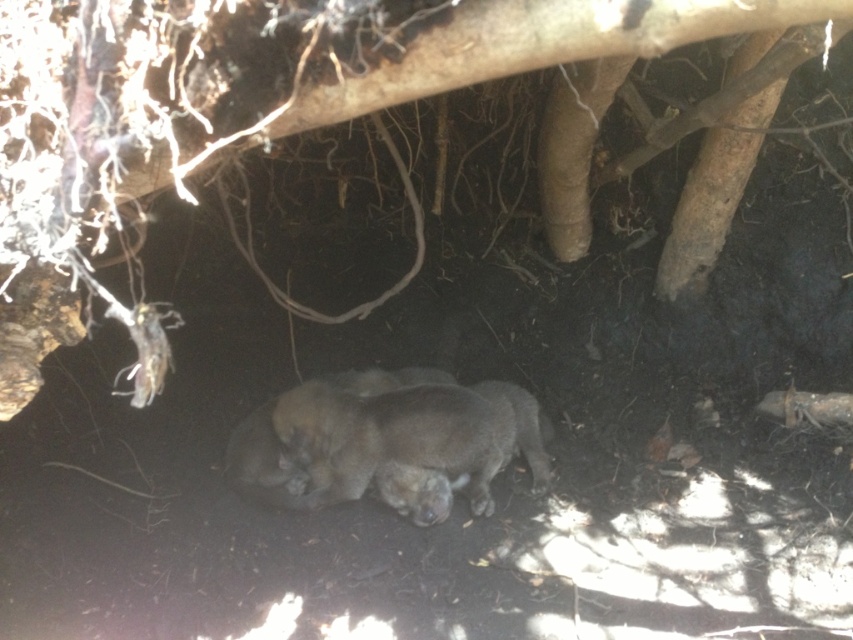
Question: Which object is closer to the camera taking this photo?

Choices:
 (A) fuzzy gray animal at center
 (B) brown rough tree trunk at center

Answer: (B)

Question: Is brown rough tree trunk at center in front of fuzzy gray animal at center?

Choices:
 (A) no
 (B) yes

Answer: (B)

Question: Is brown rough tree trunk at center below fuzzy gray animal at center?

Choices:
 (A) no
 (B) yes

Answer: (A)

Question: Which of the following is the closest to the observer?

Choices:
 (A) (497, 467)
 (B) (64, 310)

Answer: (B)

Question: Is brown rough tree trunk at center thinner than fuzzy gray animal at center?

Choices:
 (A) yes
 (B) no

Answer: (B)